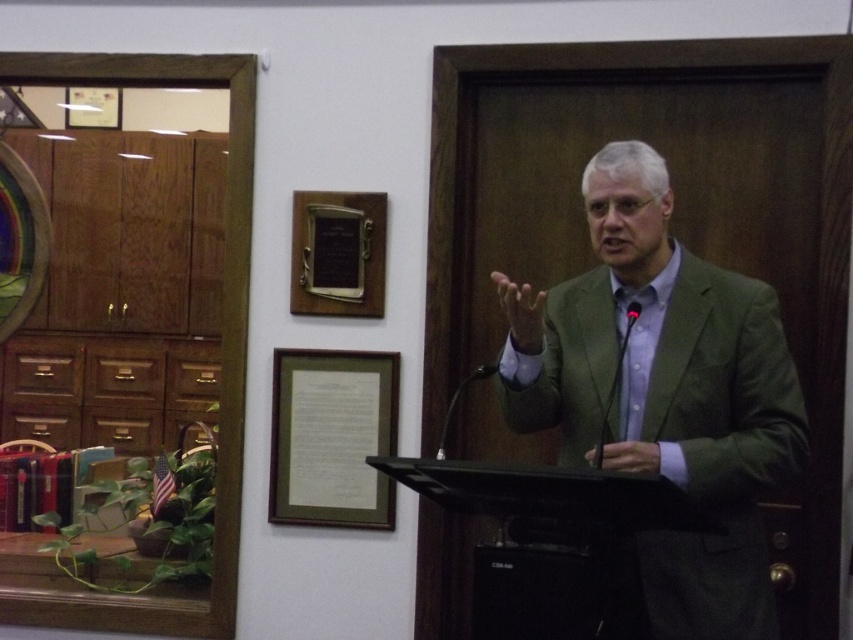
Question: Which point appears farthest from the camera in this image?

Choices:
 (A) (340, 244)
 (B) (746, 296)
 (C) (292, 472)

Answer: (C)

Question: Can you confirm if green matte picture frame at center is wider than wooden plaque at upper center?

Choices:
 (A) yes
 (B) no

Answer: (A)

Question: Estimate the real-world distances between objects in this image. Which object is farther from the wooden plaque at upper center?

Choices:
 (A) green matte picture frame at center
 (B) green fabric suit at center

Answer: (B)

Question: Is green matte picture frame at center further to the viewer compared to wooden plaque at upper center?

Choices:
 (A) yes
 (B) no

Answer: (B)

Question: Which of the following is the closest to the observer?

Choices:
 (A) (299, 227)
 (B) (373, 417)
 (C) (793, 401)

Answer: (C)

Question: Does green matte picture frame at center have a lesser width compared to wooden plaque at upper center?

Choices:
 (A) yes
 (B) no

Answer: (B)